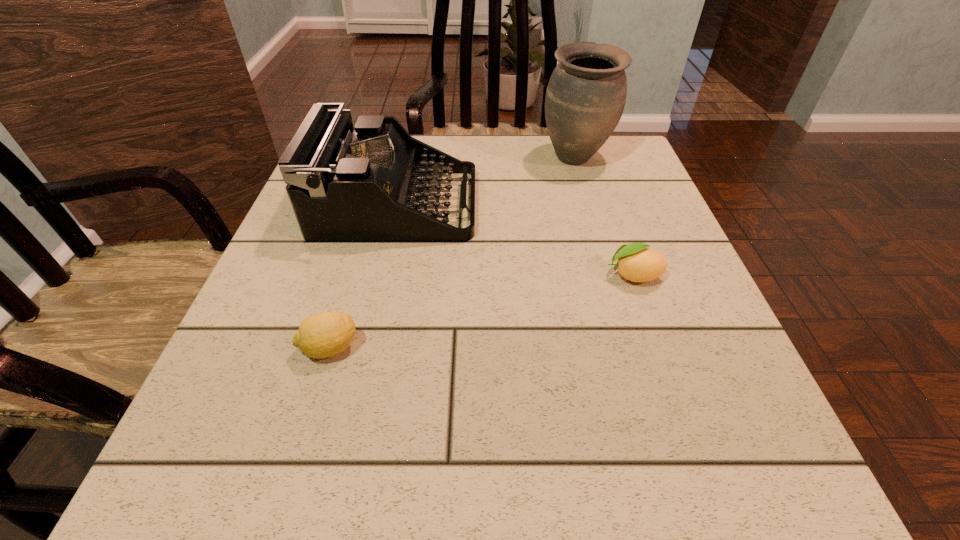
Locate an element on the screen. Image resolution: width=960 pixels, height=540 pixels. free space at the far edge is located at coordinates (518, 176).

At what (x,y) coordinates should I click in order to perform the action: click on free space at the near edge of the desktop. Please return your answer as a coordinate pair (x, y). The image size is (960, 540). Looking at the image, I should click on (357, 479).

This screenshot has width=960, height=540. What are the coordinates of `free spot at the left edge of the desktop` in the screenshot? It's located at (328, 361).

Locate an element on the screen. free location at the right edge of the desktop is located at coordinates (642, 239).

Locate an element on the screen. This screenshot has height=540, width=960. free location at the near right corner of the desktop is located at coordinates (718, 451).

Find the location of a particular element. This screenshot has width=960, height=540. blank region between the typewriter and the nearer lemon is located at coordinates (363, 276).

Locate an element on the screen. The height and width of the screenshot is (540, 960). unoccupied position between the tallest object and the left lemon is located at coordinates (452, 253).

Where is `unoccupied area between the typewriter and the left lemon`? This screenshot has width=960, height=540. unoccupied area between the typewriter and the left lemon is located at coordinates (363, 276).

Identify the location of free space between the tallest object and the farther lemon. (604, 217).

Image resolution: width=960 pixels, height=540 pixels. I want to click on blank region between the tallest object and the third farthest object, so pyautogui.click(x=604, y=217).